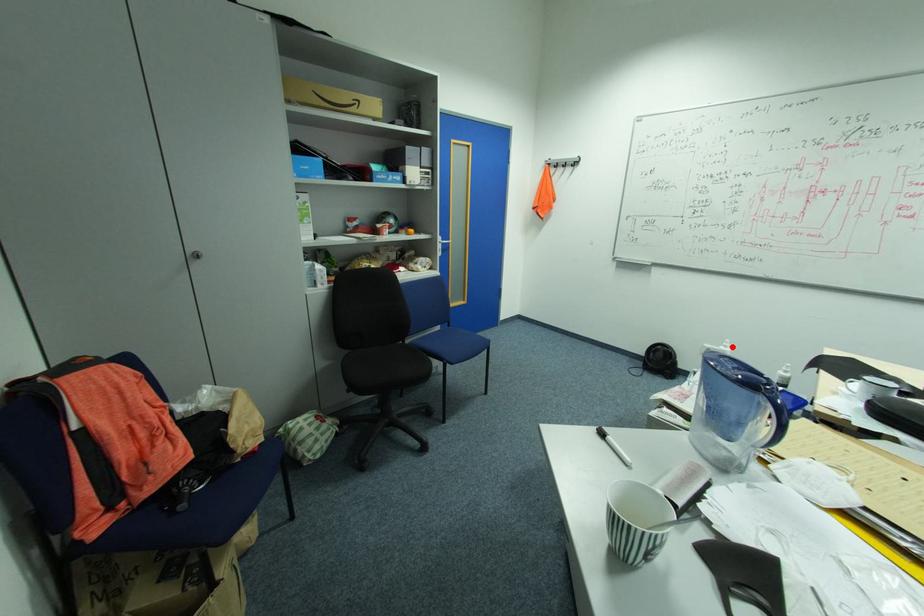
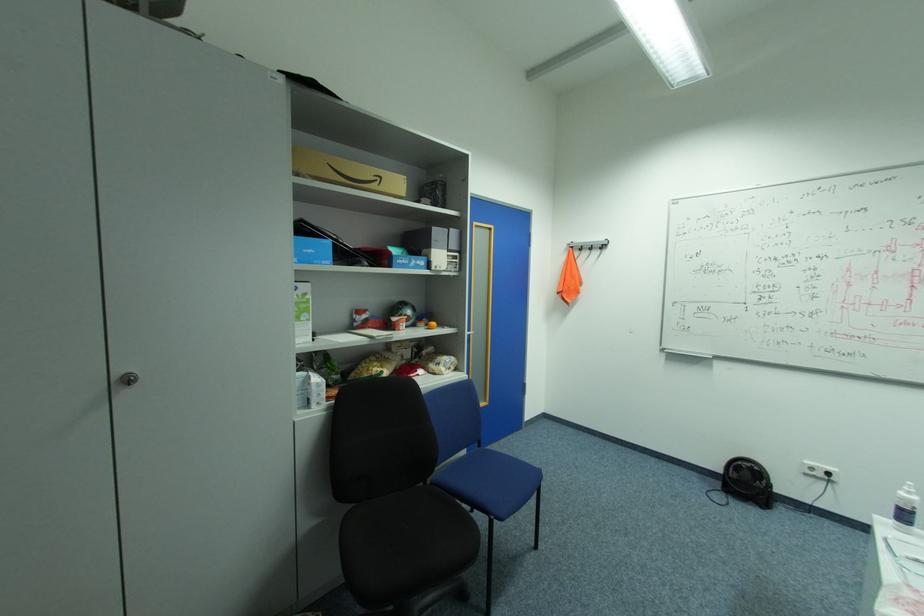
Locate, in the second image, the point that corresponds to the highlighted location in the first image.

(916, 493)